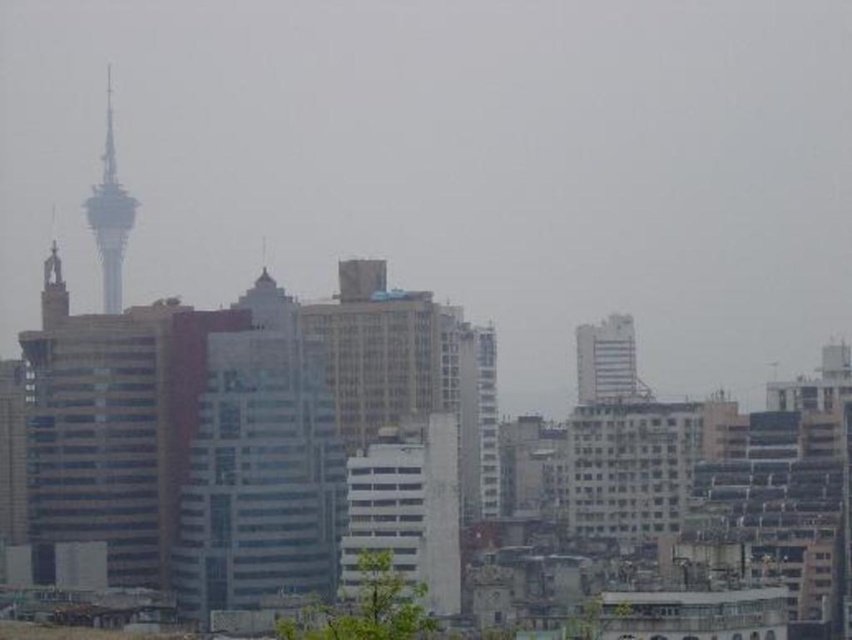
Between matte glass building at center and metallic silver tower at left, which one is positioned higher?

metallic silver tower at left

Image resolution: width=852 pixels, height=640 pixels. What do you see at coordinates (260, 467) in the screenshot?
I see `matte glass building at center` at bounding box center [260, 467].

Is point (304, 490) positioned after point (101, 272)?

No, it is not.

Locate an element on the screen. matte glass building at center is located at coordinates (260, 467).

Is point (121, 256) closer to camera compared to point (622, 333)?

No, (121, 256) is further to viewer.

Identify the location of metallic silver tower at left. (110, 214).

Is point (106, 218) less distant than point (596, 365)?

No, it is not.

Where is `metallic silver tower at left`? The height and width of the screenshot is (640, 852). metallic silver tower at left is located at coordinates (110, 214).

Can you confirm if matte glass building at center is positioned above white glossy building at upper center?

No.

Is point (273, 317) behind point (596, 356)?

No, it is in front of (596, 356).

I want to click on matte glass building at center, so click(260, 467).